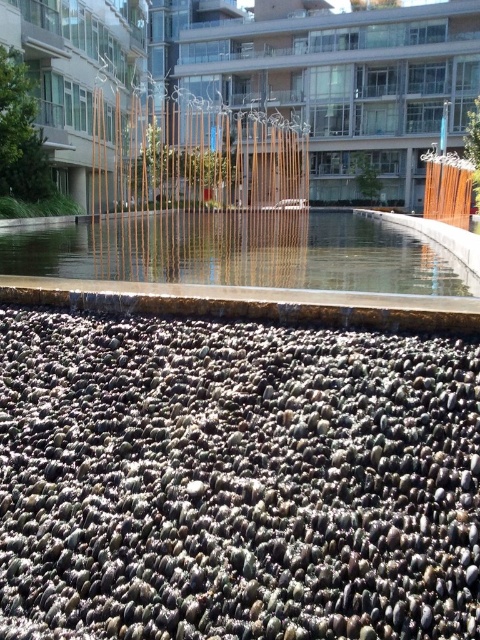
Question: Is brown wooden fence at upper center below clear glass water at center?

Choices:
 (A) yes
 (B) no

Answer: (B)

Question: Can you confirm if black pebbles at bottom is positioned to the left of brown wooden fence at upper center?

Choices:
 (A) no
 (B) yes

Answer: (A)

Question: Which object is positioned closest to the black pebbles at bottom?

Choices:
 (A) brown wooden fence at upper center
 (B) clear glass water at center

Answer: (B)

Question: Which of these objects is positioned closest to the black pebbles at bottom?

Choices:
 (A) clear glass water at center
 (B) brown wooden fence at upper center

Answer: (A)

Question: Observing the image, what is the correct spatial positioning of black pebbles at bottom in reference to clear glass water at center?

Choices:
 (A) right
 (B) left

Answer: (B)

Question: Estimate the real-world distances between objects in this image. Which object is farther from the clear glass water at center?

Choices:
 (A) brown wooden fence at upper center
 (B) black pebbles at bottom

Answer: (B)